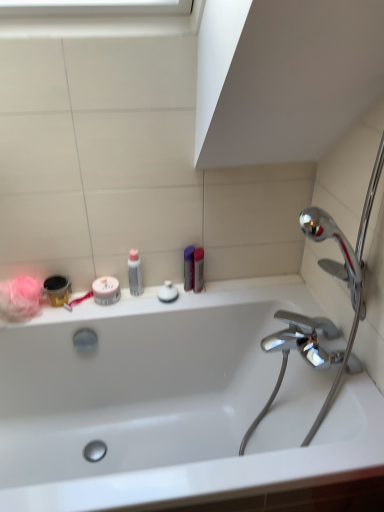
This screenshot has width=384, height=512. In order to click on vacant area that lies to the right of purple plastic container at upper center, which appears as the 1th toiletry when viewed from the right in this screenshot , I will do `click(230, 291)`.